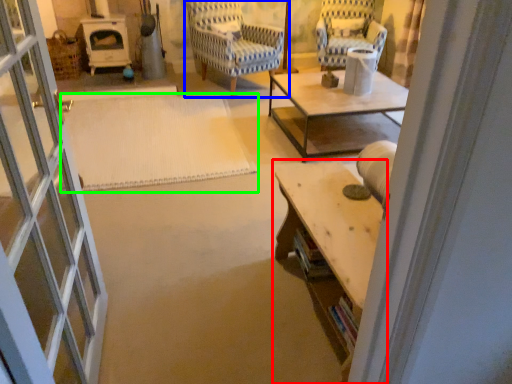
Question: Which is nearer to the table (highlighted by a red box)? chair (highlighted by a blue box) or mat (highlighted by a green box).

Choices:
 (A) chair
 (B) mat

Answer: (B)